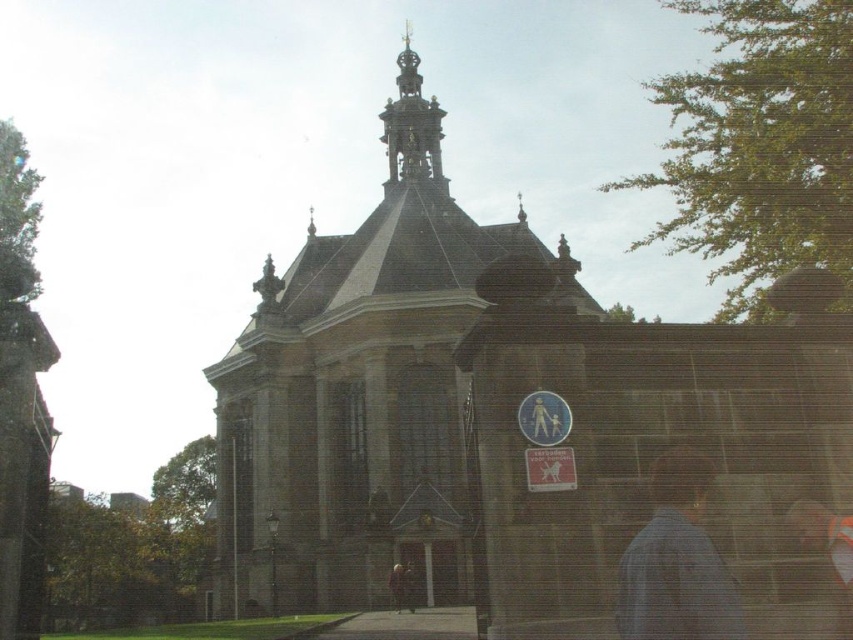
Question: Can you confirm if gold ornate spire at upper center is thinner than light brown leather jacket at center?

Choices:
 (A) no
 (B) yes

Answer: (A)

Question: Which point is closer to the camera?

Choices:
 (A) dark gray stone chapel at center
 (B) light brown leather jacket at center
 (C) gold ornate spire at upper center

Answer: (A)

Question: Among these points, which one is farthest from the camera?

Choices:
 (A) (387, 140)
 (B) (397, 566)
 (C) (660, 497)

Answer: (A)

Question: Is dark gray stone chapel at center further to camera compared to blue denim jacket at lower right?

Choices:
 (A) yes
 (B) no

Answer: (A)

Question: Can you confirm if blue denim jacket at lower right is thinner than light brown leather jacket at center?

Choices:
 (A) no
 (B) yes

Answer: (A)

Question: Which object appears closest to the camera in this image?

Choices:
 (A) gold ornate spire at upper center
 (B) dark gray stone chapel at center
 (C) light brown leather jacket at center

Answer: (B)